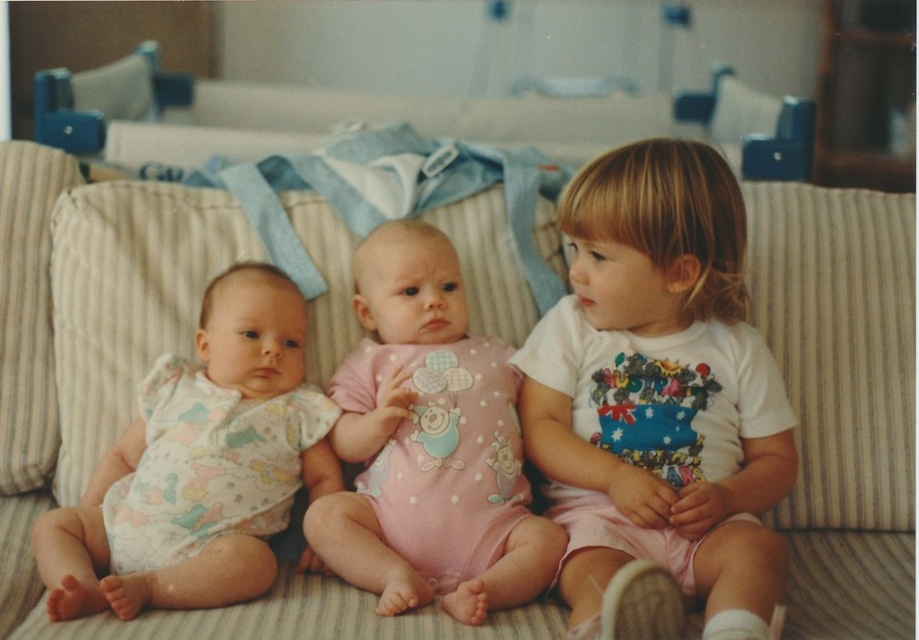
Question: Which of these objects is positioned farthest from the blue fabric playpen at upper center?

Choices:
 (A) printed cotton onesie at left
 (B) white cotton shirt at center
 (C) pink cotton onesie at center

Answer: (B)

Question: Which point is farther to the camera?

Choices:
 (A) white cotton shirt at center
 (B) pink cotton onesie at center
 (C) blue fabric playpen at upper center

Answer: (C)

Question: Is printed cotton onesie at left to the right of blue fabric playpen at upper center from the viewer's perspective?

Choices:
 (A) yes
 (B) no

Answer: (A)

Question: Which point is closer to the camera?

Choices:
 (A) (154, 531)
 (B) (769, 144)
 (C) (657, 433)
 (D) (441, 499)

Answer: (A)

Question: In this image, where is pink cotton onesie at center located relative to printed cotton onesie at left?

Choices:
 (A) below
 (B) above

Answer: (B)

Question: Is printed cotton onesie at left positioned before blue fabric playpen at upper center?

Choices:
 (A) no
 (B) yes

Answer: (B)